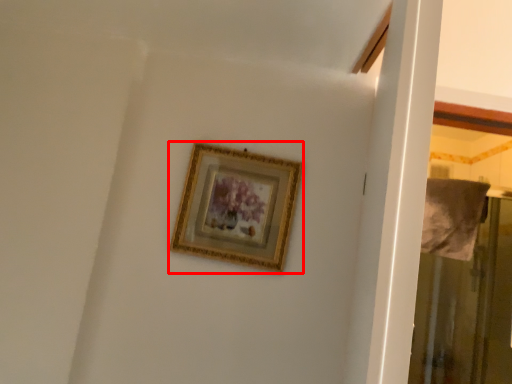
Question: From the image's perspective, considering the relative positions of picture frame (annotated by the red box) and screen door in the image provided, where is picture frame (annotated by the red box) located with respect to the staircase?

Choices:
 (A) above
 (B) below

Answer: (A)